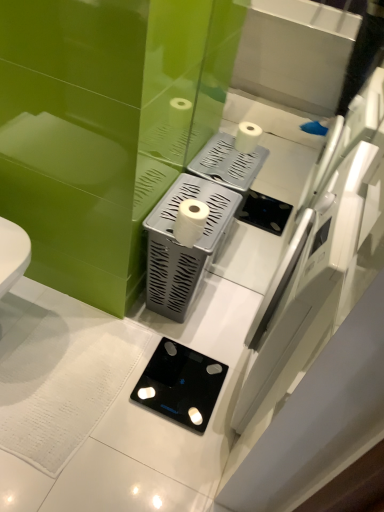
The image size is (384, 512). In order to click on space that is in front of black glass scale at lower center in this screenshot , I will do `click(161, 452)`.